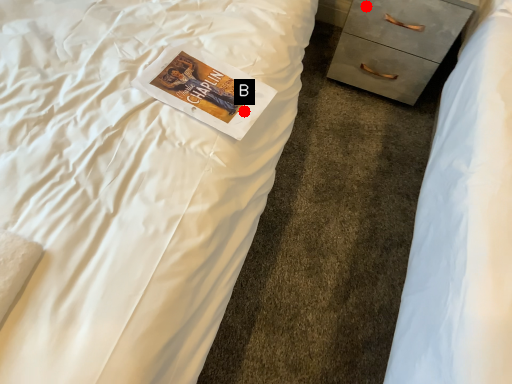
Question: Two points are circled on the image, labeled by A and B beside each circle. Which point is further to the camera?

Choices:
 (A) A is further
 (B) B is further

Answer: (A)